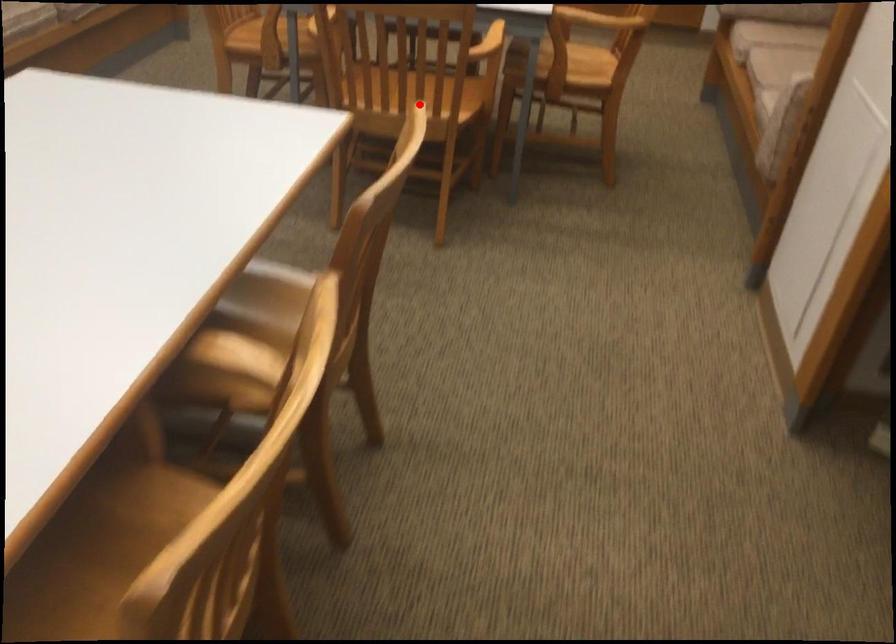
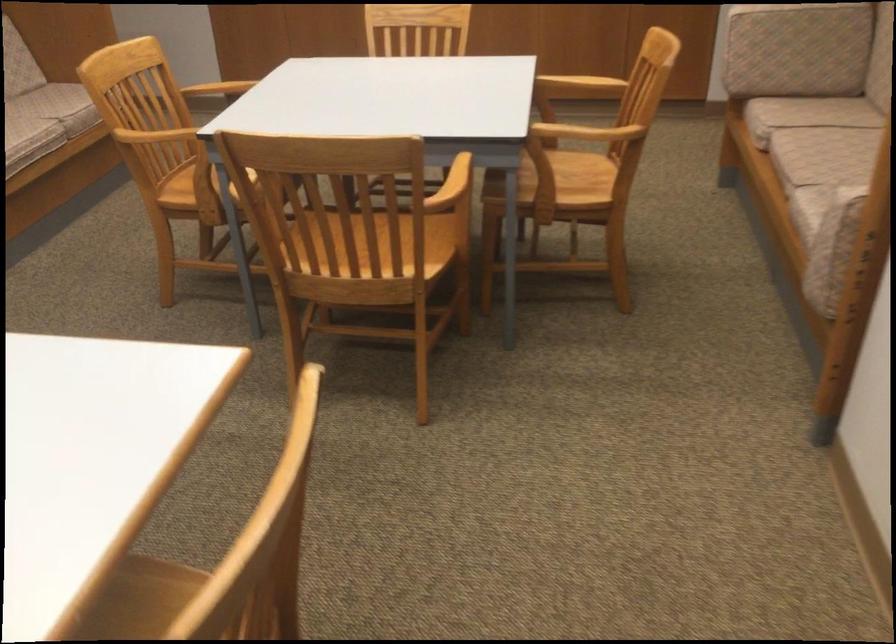
Question: I am providing you with two images of the same scene from different viewpoints. A red point is marked on the first image. At the location where the point appears in image 1, is it still visible in image 2?

Choices:
 (A) Yes
 (B) No

Answer: (B)